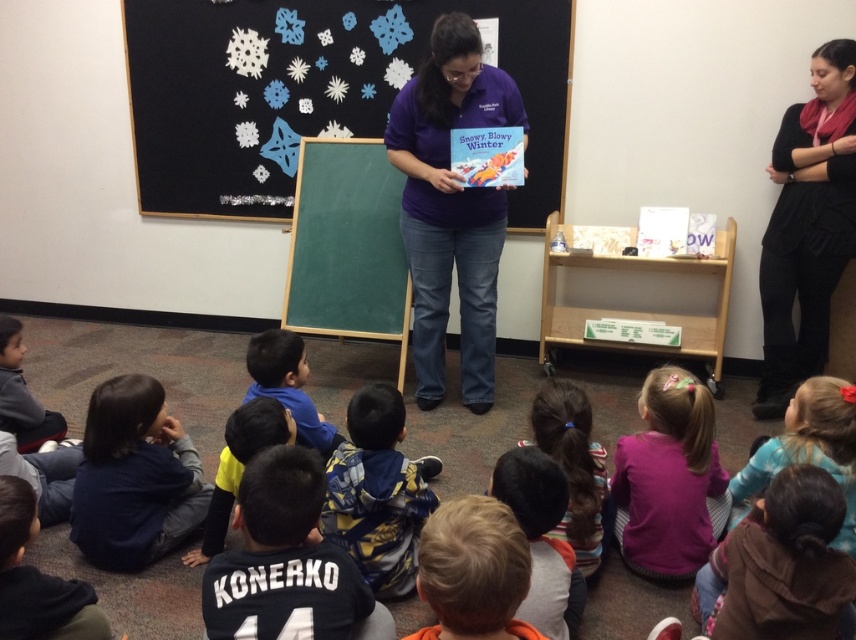
Does brown fuzzy hoodie at lower right have a greater width compared to purple fleece shirt at lower center?

In fact, brown fuzzy hoodie at lower right might be narrower than purple fleece shirt at lower center.

Between brown fuzzy hoodie at lower right and purple fleece shirt at lower center, which one is positioned higher?

purple fleece shirt at lower center is higher up.

Between point (815, 536) and point (688, 451), which one is positioned behind?

The point (688, 451) is more distant.

Where is `brown fuzzy hoodie at lower right`? brown fuzzy hoodie at lower right is located at coordinates (786, 563).

Which is behind, point (97, 465) or point (18, 448)?

Positioned behind is point (18, 448).

Is dark blue sweater at lower left closer to the viewer compared to dark gray hoodie at lower left?

Yes, it is.

Is point (174, 429) positioned before point (55, 436)?

Yes, point (174, 429) is closer to viewer.

The height and width of the screenshot is (640, 856). Find the location of `dark blue sweater at lower left`. dark blue sweater at lower left is located at coordinates (134, 477).

Is purple fleece shirt at lower center bigger than blonde hair at lower center?

Correct, purple fleece shirt at lower center is larger in size than blonde hair at lower center.

Who is positioned more to the left, purple fleece shirt at lower center or blonde hair at lower center?

Positioned to the left is blonde hair at lower center.

Which is in front, point (682, 492) or point (435, 573)?

Point (435, 573) is more forward.

At what (x,y) coordinates should I click in order to perform the action: click on purple fleece shirt at lower center. Please return your answer as a coordinate pair (x, y). This screenshot has height=640, width=856. Looking at the image, I should click on (669, 480).